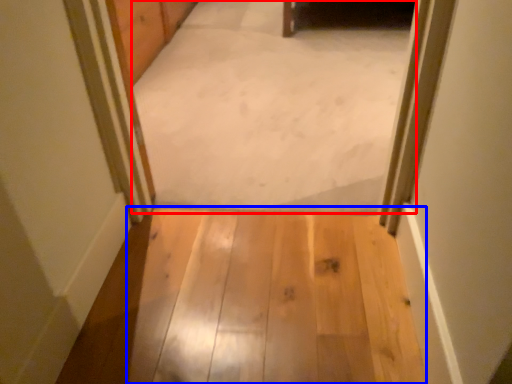
Question: Which of the following is the closest to the observer, passage (highlighted by a red box) or path (highlighted by a blue box)?

Choices:
 (A) passage
 (B) path

Answer: (B)